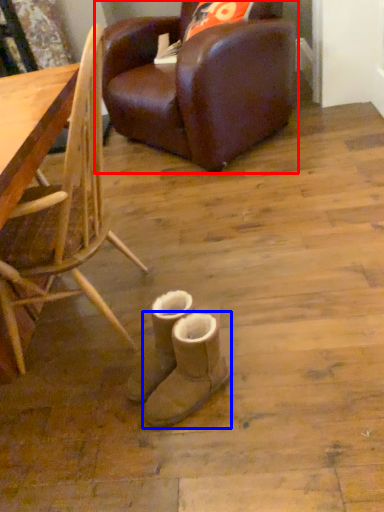
Question: Which object appears farthest to the camera in this image, chair (highlighted by a red box) or footwear (highlighted by a blue box)?

Choices:
 (A) chair
 (B) footwear

Answer: (A)